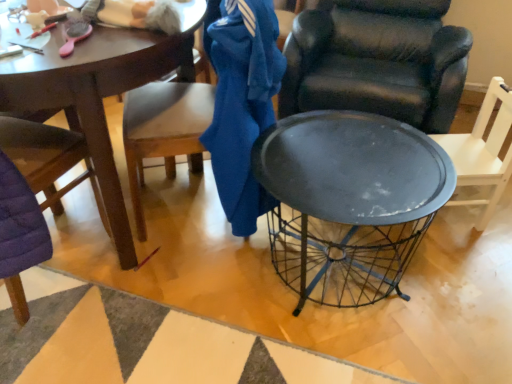
You are a GUI agent. You are given a task and a screenshot of the screen. Output one action in this format:
    pyautogui.click(x=<x>, y=<y>)
    Task: Click on the vacant space to the right of metallic black table at center
    This screenshot has width=512, height=384.
    Given the screenshot: What is the action you would take?
    [464, 286]